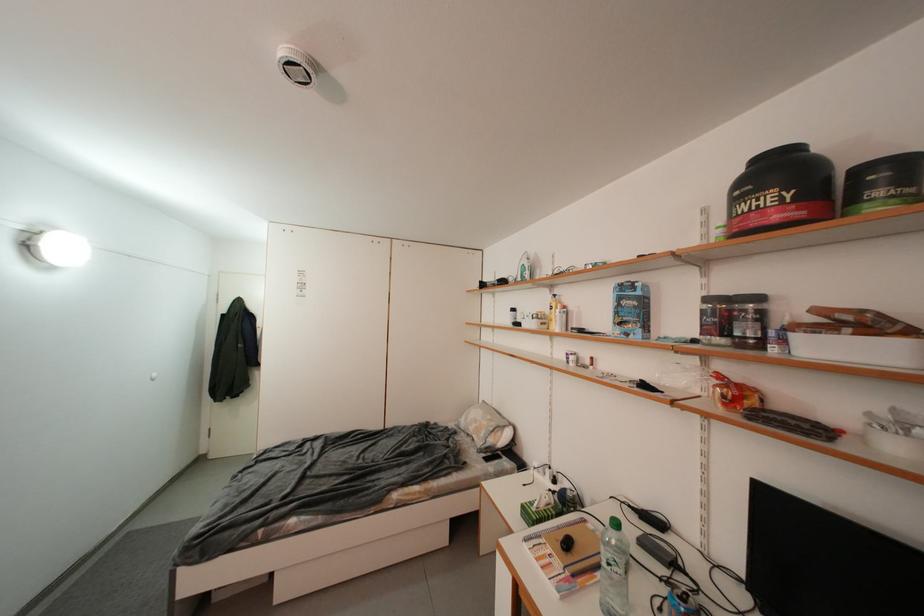
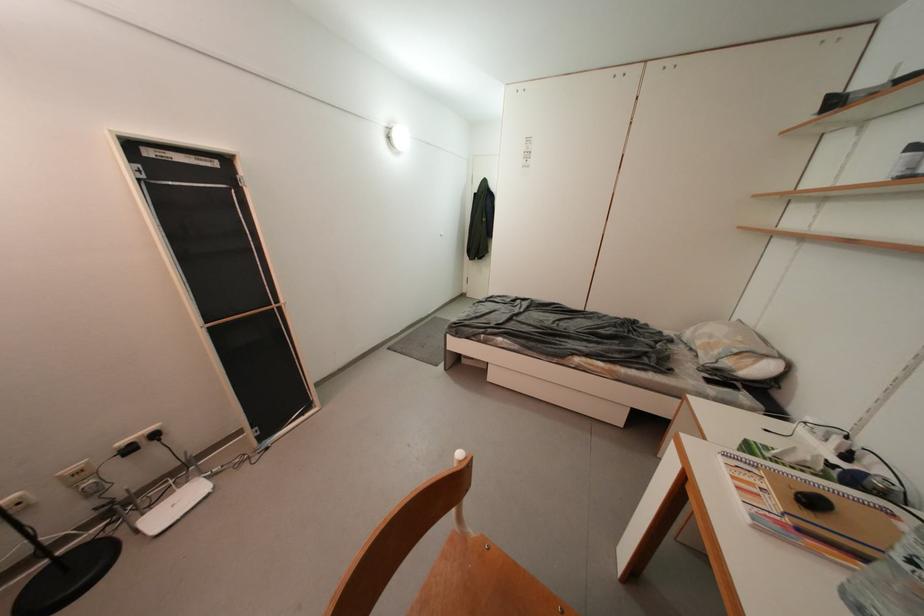
First-person continuous shooting, in which direction is the camera rotating?

The camera rotated toward left-down.